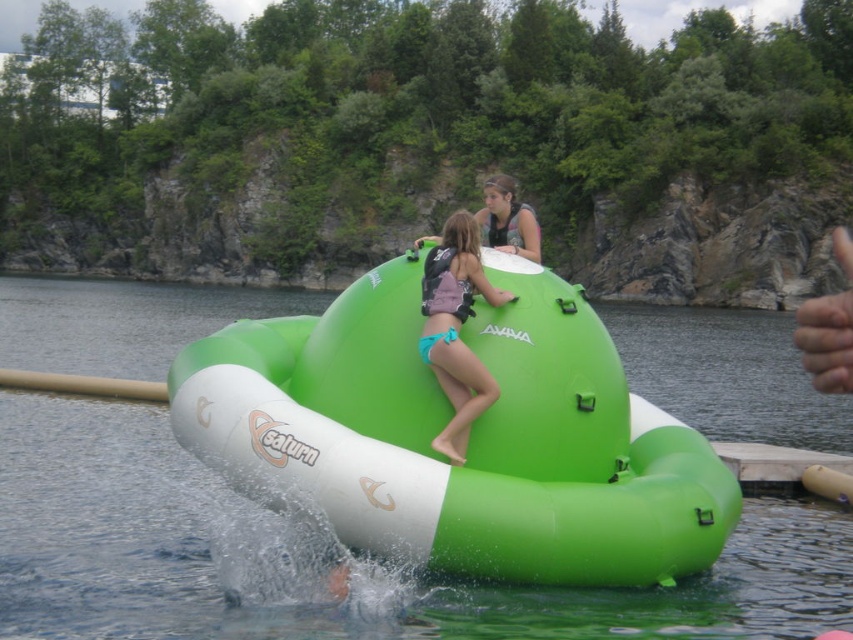
Question: In this image, where is green rubber boat at center located relative to teal fabric bikini at center?

Choices:
 (A) above
 (B) below

Answer: (B)

Question: Is green rubber boat at center to the right of teal fabric bikini at center from the viewer's perspective?

Choices:
 (A) yes
 (B) no

Answer: (A)

Question: Does green rubber boat at center appear under teal fabric bikini at center?

Choices:
 (A) yes
 (B) no

Answer: (A)